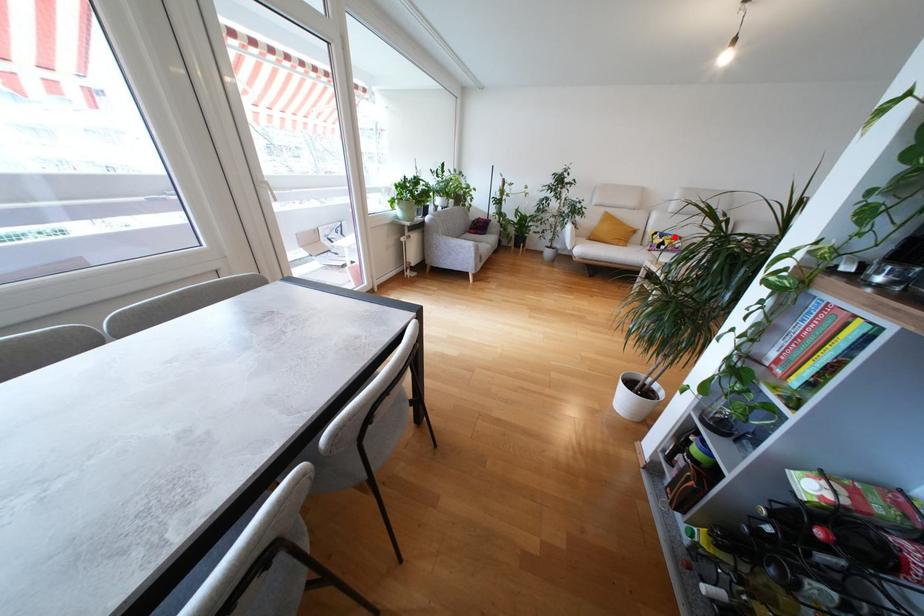
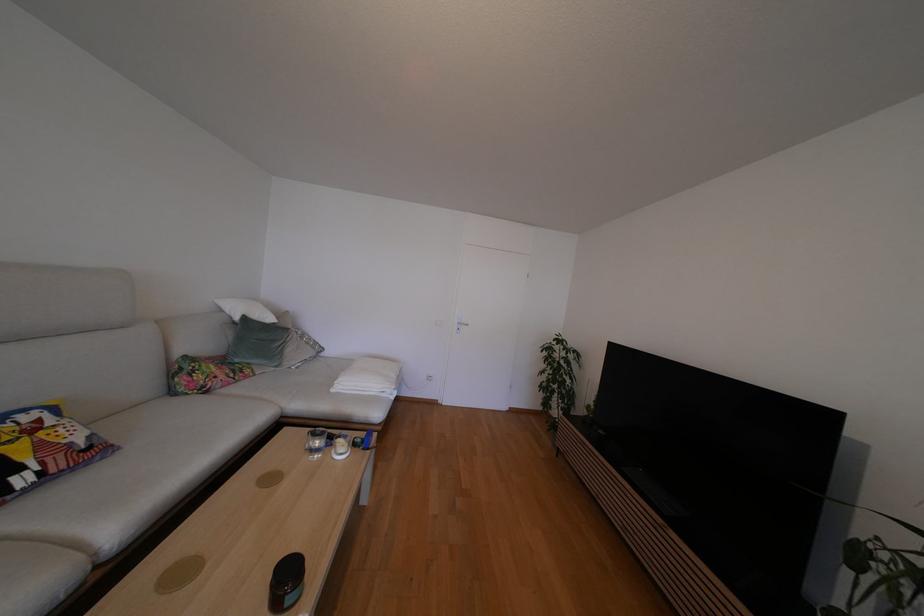
Question: I am providing you with two images of the same scene from different viewpoints. A red point is shown in image1. For the corresponding object point in image2, is it positioned nearer or farther from the camera?

Choices:
 (A) Nearer
 (B) Farther

Answer: (B)